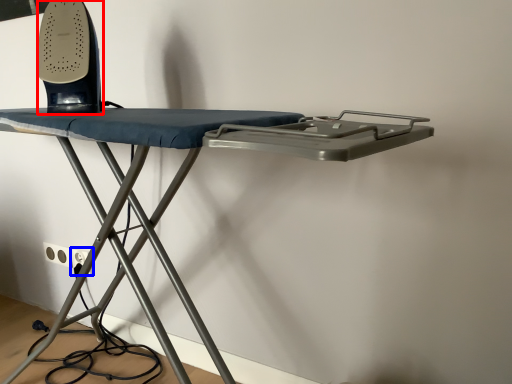
Question: Which object is further to the camera taking this photo, equipment (highlighted by a red box) or electric outlet (highlighted by a blue box)?

Choices:
 (A) equipment
 (B) electric outlet

Answer: (B)